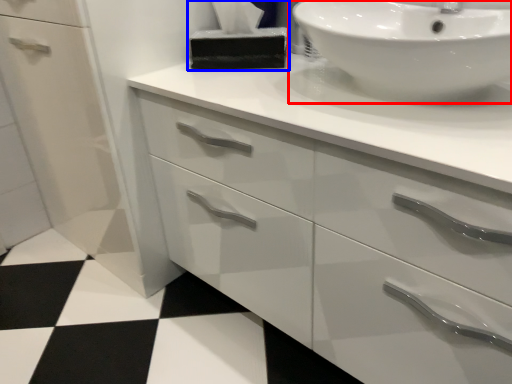
Question: Among these objects, which one is nearest to the camera, sink (highlighted by a red box) or tissue (highlighted by a blue box)?

Choices:
 (A) sink
 (B) tissue

Answer: (A)